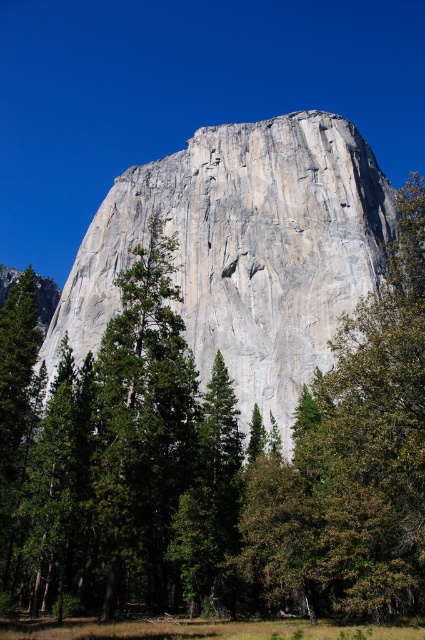
Consider the image. Can you confirm if gray/rough rock at center is shorter than green leafy tree at center?

No, gray/rough rock at center is not shorter than green leafy tree at center.

Which is behind, point (82, 326) or point (401, 456)?

The point (82, 326) is behind.

Is point (195, 221) positioned behind point (388, 573)?

Yes, point (195, 221) is behind point (388, 573).

This screenshot has width=425, height=640. What are the coordinates of `gray/rough rock at center` in the screenshot? It's located at (244, 250).